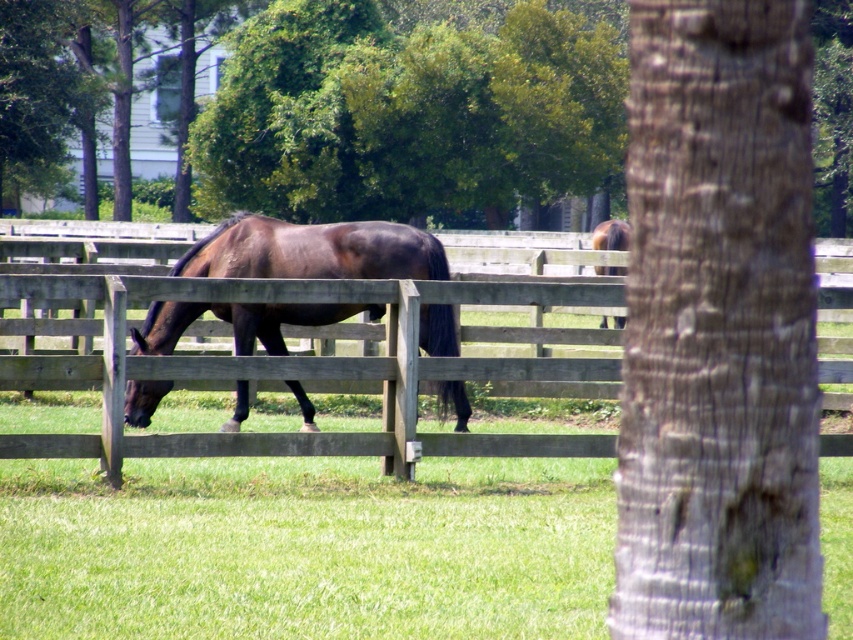
You are standing in the pasture and want to walk to the green leafy tree at upper center. Do you need to go around the wooden fence at center first?

The green leafy tree at upper center is closer to you than the wooden fence at center, so you can walk directly to the green leafy tree at upper center without needing to go around the wooden fence at center.

You are a farmer checking the pasture. You see the wooden fence at center and the shiny brown horse at center. Which object is positioned higher in the image?

The wooden fence at center is above the shiny brown horse at center in the image.

You are standing in the pasture looking at the horse. There are two points marked in the image. The first point is at coordinates point (656, 81) and the second point is at point (444, 106). Which of these two points is closer to your current position?

Point (656, 81) is closer to the camera than point (444, 106), so the first point is closer to your current position.